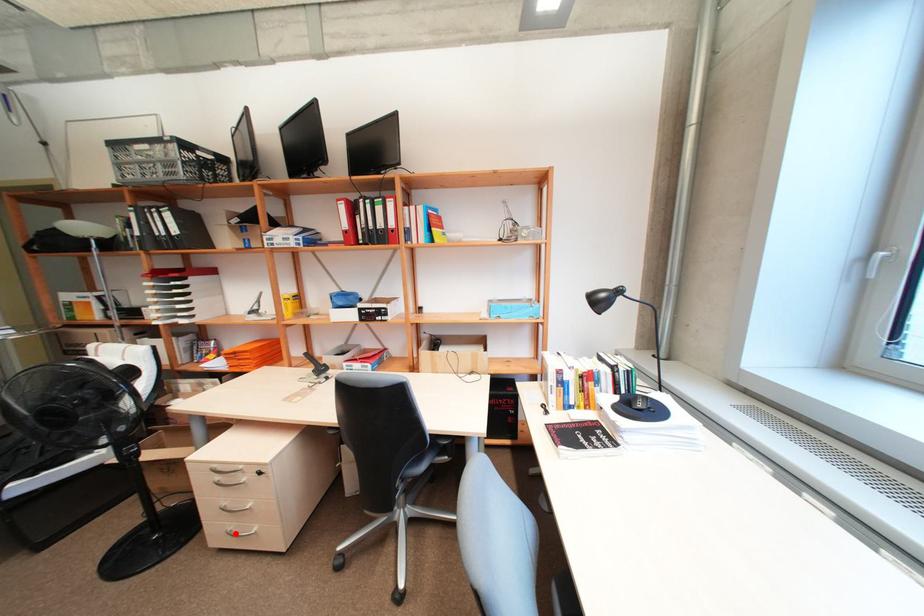
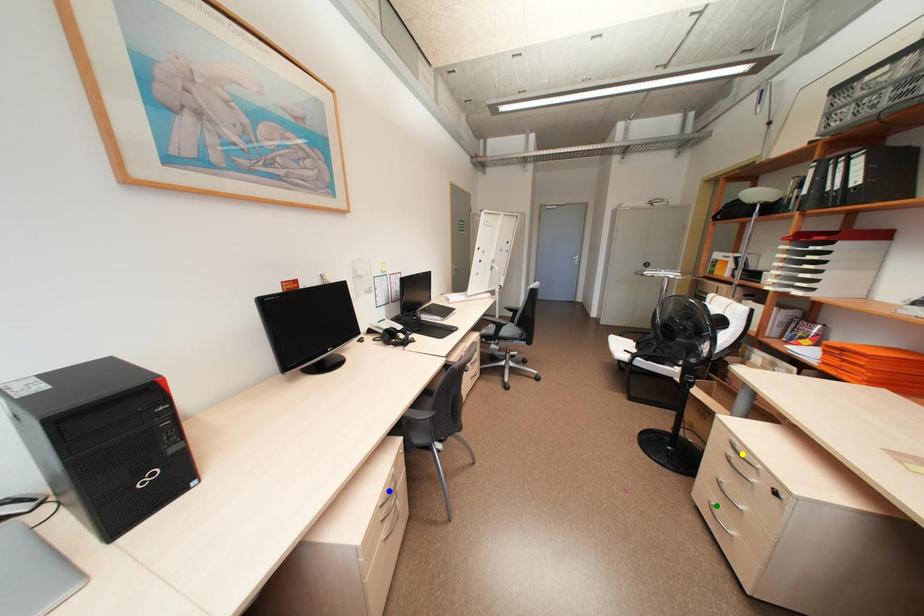
Question: I am providing you with two images of the same scene from different viewpoints. A red point is marked on the first image. You are given multiple points on the second image. In image 2, which mark is for the same physical point as the one in image 1?

Choices:
 (A) yellow point
 (B) blue point
 (C) green point

Answer: (C)